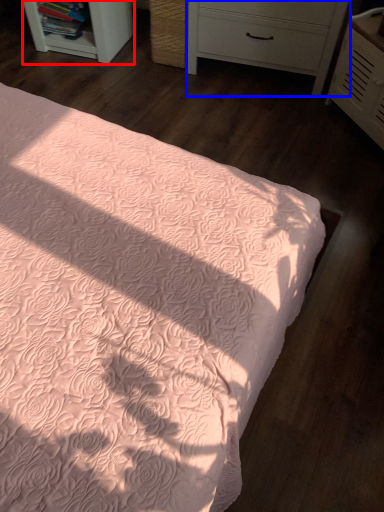
Question: Which object appears closest to the camera in this image, shelf (highlighted by a red box) or chest of drawers (highlighted by a blue box)?

Choices:
 (A) shelf
 (B) chest of drawers

Answer: (B)